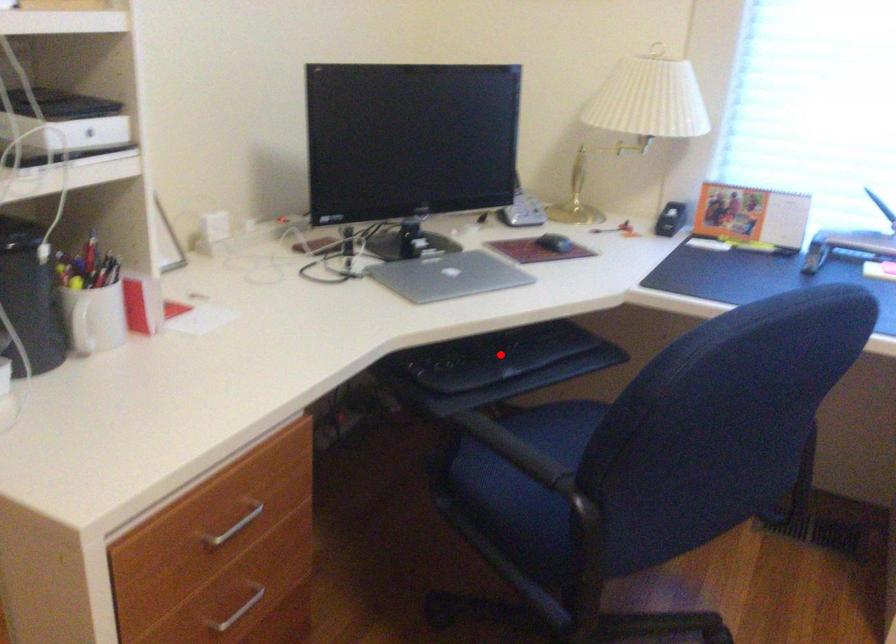
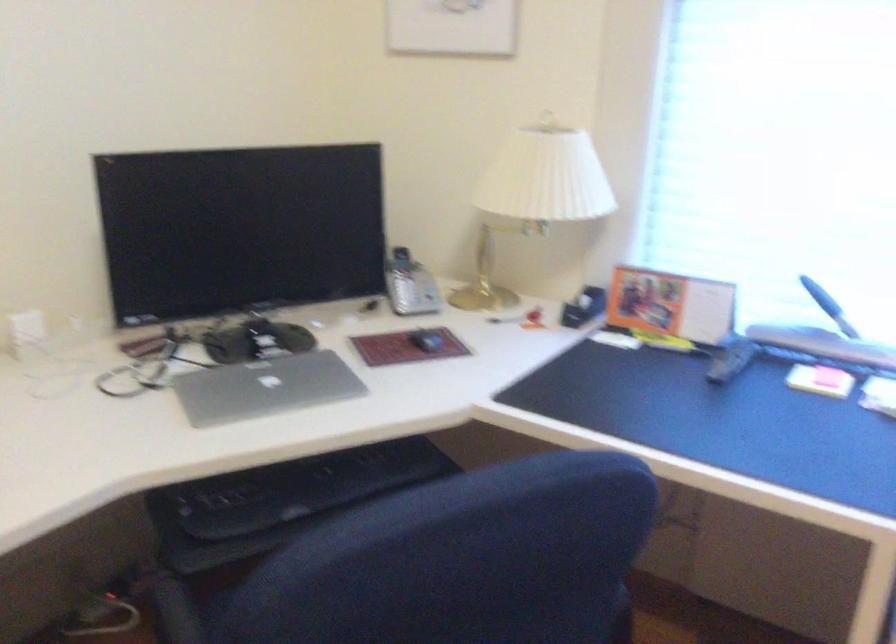
Question: I am providing you with two images of the same scene from different viewpoints. Given a red point in image1, look at the same physical point in image2. Is it:

Choices:
 (A) Closer to the viewpoint
 (B) Farther from the viewpoint

Answer: (A)